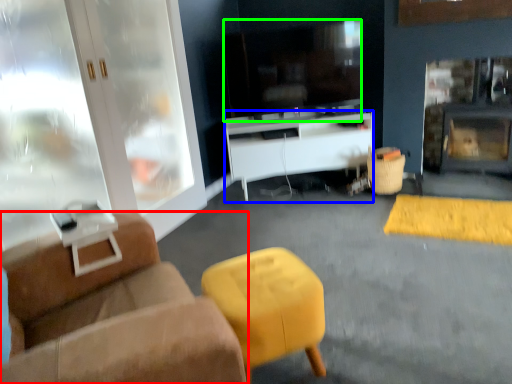
Question: Estimate the real-world distances between objects in this image. Which object is closer to studio couch (highlighted by a red box), desk (highlighted by a blue box) or television (highlighted by a green box)?

Choices:
 (A) desk
 (B) television

Answer: (A)